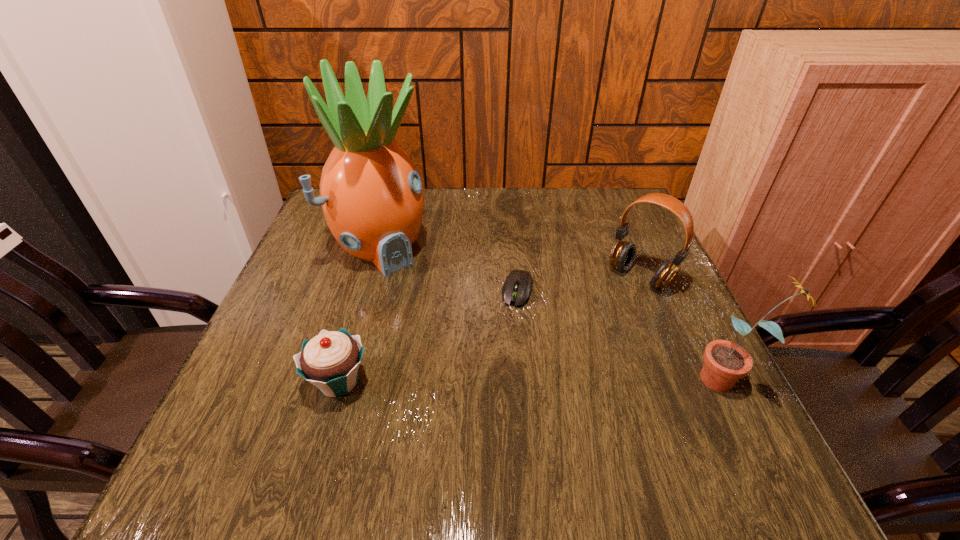
What are the coordinates of `cupcake located in the near edge section of the desktop` in the screenshot? It's located at tap(330, 361).

Identify the location of sunflower located in the near edge section of the desktop. (725, 362).

You are a GUI agent. You are given a task and a screenshot of the screen. Output one action in this format:
    pyautogui.click(x=<x>, y=<y>)
    Task: Click on the cupcake that is at the left edge
    
    Given the screenshot: What is the action you would take?
    pyautogui.click(x=330, y=361)

This screenshot has height=540, width=960. In order to click on pineapple at the left edge in this screenshot , I will do `click(372, 197)`.

At what (x,y) coordinates should I click in order to perform the action: click on sunflower positioned at the right edge. Please return your answer as a coordinate pair (x, y). Image resolution: width=960 pixels, height=540 pixels. Looking at the image, I should click on (725, 362).

Image resolution: width=960 pixels, height=540 pixels. Identify the location of headset that is at the right edge. 623,253.

You are a GUI agent. You are given a task and a screenshot of the screen. Output one action in this format:
    pyautogui.click(x=<x>, y=<y>)
    Task: Click on the object at the far left corner
    
    Given the screenshot: What is the action you would take?
    pyautogui.click(x=372, y=197)

In order to click on object at the near left corner in this screenshot , I will do `click(330, 361)`.

The width and height of the screenshot is (960, 540). I want to click on object that is at the near right corner, so click(725, 362).

In the image, there is a desktop. At what (x,y) coordinates should I click in order to perform the action: click on free region at the far edge. Please return your answer as a coordinate pair (x, y). This screenshot has width=960, height=540. Looking at the image, I should click on (468, 188).